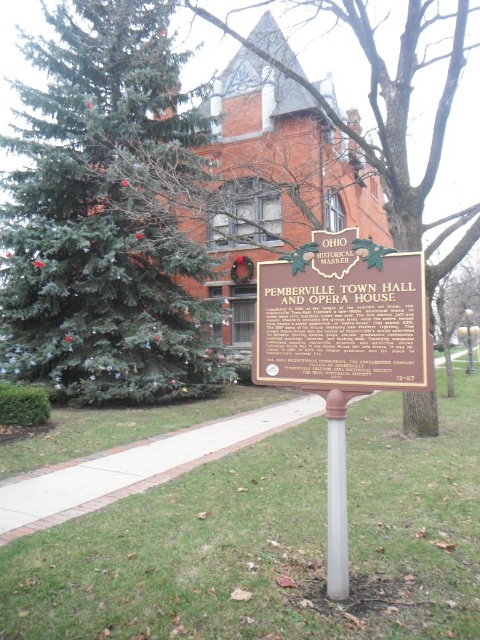
Can you confirm if brown polished wood sign at center is shorter than white plastic pole at center?

Correct, brown polished wood sign at center is not as tall as white plastic pole at center.

Which is more to the right, brown polished wood sign at center or white plastic pole at center?

Positioned to the right is white plastic pole at center.

Does point (340, 230) come behind point (336, 529)?

Yes, it is behind point (336, 529).

At what (x,y) coordinates should I click in order to perform the action: click on brown polished wood sign at center. Please return your answer as a coordinate pair (x, y). This screenshot has height=640, width=480. Looking at the image, I should click on (342, 316).

Can you confirm if brown polished wood sign at center is wider than green textured pine tree at upper left?

No, brown polished wood sign at center is not wider than green textured pine tree at upper left.

Does brown polished wood sign at center have a lesser width compared to green textured pine tree at upper left?

Yes.

Between point (360, 288) and point (307, 1), which one is positioned behind?

The point (307, 1) is more distant.

Where is `brown polished wood sign at center`? The image size is (480, 640). brown polished wood sign at center is located at coordinates (342, 316).

In the scene shown: Is green textured pine tree at left bigger than green textured pine tree at upper left?

No.

Locate an element on the screen. The width and height of the screenshot is (480, 640). green textured pine tree at left is located at coordinates (105, 216).